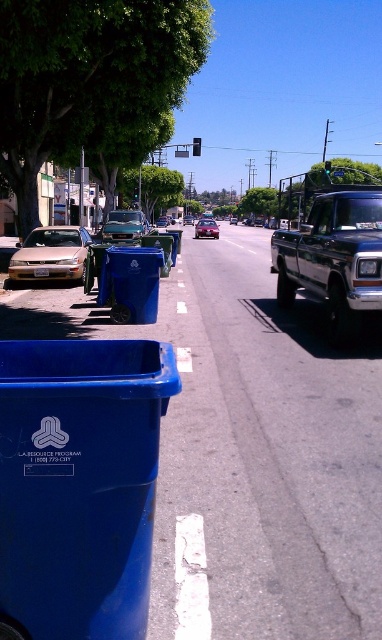
Is blue plastic recycling bin at lower left taller than metallic blue truck at right?

No.

Identify the location of blue plastic recycling bin at lower left. This screenshot has height=640, width=382. (79, 484).

Locate an element on the screen. This screenshot has height=640, width=382. blue plastic recycling bin at lower left is located at coordinates (79, 484).

Does gold metallic sedan at left appear on the right side of metallic red car at center?

Incorrect, gold metallic sedan at left is not on the right side of metallic red car at center.

Is gold metallic sedan at left smaller than metallic red car at center?

Correct, gold metallic sedan at left occupies less space than metallic red car at center.

Is point (30, 260) positioned behind point (199, 234)?

No, (30, 260) is closer to viewer.

You are a GUI agent. You are given a task and a screenshot of the screen. Output one action in this format:
    pyautogui.click(x=<x>, y=<y>)
    Task: Click on the gold metallic sedan at left
    This screenshot has width=382, height=640.
    Given the screenshot: What is the action you would take?
    pyautogui.click(x=51, y=253)

In the scene shown: Between blue plastic recycling bin at lower left and metallic silver car at center, which one appears on the left side from the viewer's perspective?

Positioned to the left is metallic silver car at center.

Is blue plastic recycling bin at lower left thinner than metallic silver car at center?

Correct, blue plastic recycling bin at lower left's width is less than metallic silver car at center's.

Where is `blue plastic recycling bin at lower left`? This screenshot has width=382, height=640. blue plastic recycling bin at lower left is located at coordinates (79, 484).

The height and width of the screenshot is (640, 382). Identify the location of blue plastic recycling bin at lower left. (79, 484).